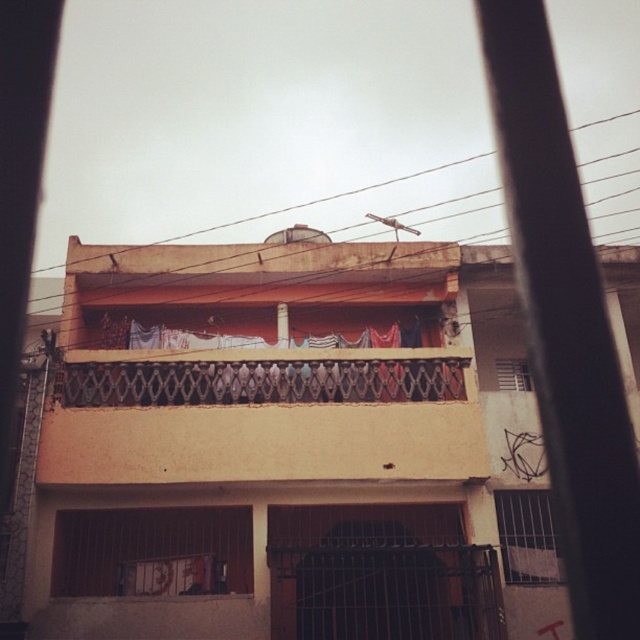
Question: Which object is farther from the camera taking this photo?

Choices:
 (A) matte white window at center
 (B) brown wire at upper center

Answer: (A)

Question: Does white metal bars at lower right have a greater width compared to matte white window at center?

Choices:
 (A) no
 (B) yes

Answer: (B)

Question: Is metallic lattice balcony at center smaller than matte white window at center?

Choices:
 (A) no
 (B) yes

Answer: (A)

Question: Which of the following is the closest to the observer?

Choices:
 (A) white fabric laundry at center
 (B) metallic lattice balcony at center
 (C) matte white window at center

Answer: (B)

Question: Which point is closer to the camera taking this photo?

Choices:
 (A) (204, 232)
 (B) (259, 342)
 (C) (449, 385)

Answer: (C)

Question: From the image, what is the correct spatial relationship of metallic lattice balcony at center in relation to brown wire at upper center?

Choices:
 (A) left
 (B) right

Answer: (A)